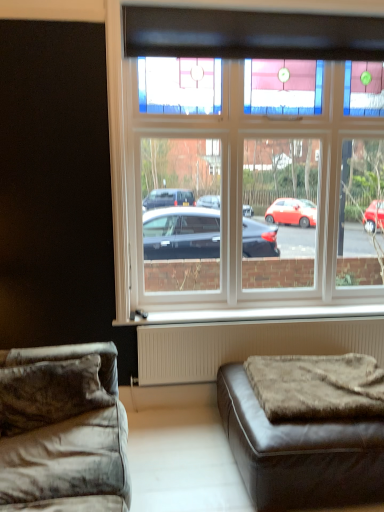
Measure the distance between point (322, 323) and camera.

Point (322, 323) and camera are 2.88 meters apart.

In order to click on clear glass window at upper center in this screenshot , I will do `click(134, 143)`.

Image resolution: width=384 pixels, height=512 pixels. Describe the element at coordinates (299, 453) in the screenshot. I see `brown leather ottoman at lower right, the second studio couch from the left` at that location.

In order to face velvet gray couch at lower left, the 2th studio couch when ordered from right to left, should I rotate leftwards or rightwards?

You should look left and rotate roughly 20.479 degrees.

What are the coordinates of `white textured radiator at lower center` in the screenshot? It's located at [x=247, y=345].

Would you say brown leather ottoman at lower right, positioned as the first studio couch in right-to-left order, is outside white textured radiator at lower center?

Indeed, brown leather ottoman at lower right, positioned as the first studio couch in right-to-left order, is completely outside white textured radiator at lower center.

Looking at this image, considering the sizes of objects brown leather ottoman at lower right, the second studio couch from the left, and white textured radiator at lower center in the image provided, who is wider, brown leather ottoman at lower right, the second studio couch from the left, or white textured radiator at lower center?

Wider between the two is brown leather ottoman at lower right, the second studio couch from the left.

Is brown leather ottoman at lower right, positioned as the first studio couch in right-to-left order, at the left side of white textured radiator at lower center?

In fact, brown leather ottoman at lower right, positioned as the first studio couch in right-to-left order, is to the right of white textured radiator at lower center.

From a real-world perspective, is brown leather ottoman at lower right, the second studio couch from the left, physically below white textured radiator at lower center?

Indeed, from a real-world perspective, brown leather ottoman at lower right, the second studio couch from the left, is positioned beneath white textured radiator at lower center.

Does clear glass window at upper center turn towards white textured radiator at lower center?

No, clear glass window at upper center does not turn towards white textured radiator at lower center.

Does clear glass window at upper center have a smaller size compared to white textured radiator at lower center?

Incorrect, clear glass window at upper center is not smaller in size than white textured radiator at lower center.

Based on the photo, which object is wider, clear glass window at upper center or white textured radiator at lower center?

white textured radiator at lower center is wider.

The image size is (384, 512). What are the coordinates of `window above the white textured radiator at lower center (from the image's perspective)` in the screenshot? It's located at (134, 143).

Considering the points (333, 350) and (357, 460), which point is behind, point (333, 350) or point (357, 460)?

Point (333, 350)

Which of these two, white textured radiator at lower center or brown leather ottoman at lower right, positioned as the first studio couch in right-to-left order, stands shorter?

brown leather ottoman at lower right, positioned as the first studio couch in right-to-left order.

Is white textured radiator at lower center positioned with its back to brown leather ottoman at lower right, positioned as the first studio couch in right-to-left order?

white textured radiator at lower center is not turned away from brown leather ottoman at lower right, positioned as the first studio couch in right-to-left order.

Is white textured radiator at lower center not close to brown leather ottoman at lower right, positioned as the first studio couch in right-to-left order?

No, white textured radiator at lower center is not far from brown leather ottoman at lower right, positioned as the first studio couch in right-to-left order.

From a real-world perspective, is white plastic window sill at lower center above or below brown leather ottoman at lower right, the second studio couch from the left?

white plastic window sill at lower center is situated higher than brown leather ottoman at lower right, the second studio couch from the left, in the real world.

In terms of size, does white plastic window sill at lower center appear bigger or smaller than brown leather ottoman at lower right, the second studio couch from the left?

In the image, white plastic window sill at lower center appears to be smaller than brown leather ottoman at lower right, the second studio couch from the left.

Measure the distance between white plastic window sill at lower center and brown leather ottoman at lower right, the second studio couch from the left.

white plastic window sill at lower center is 35.70 inches away from brown leather ottoman at lower right, the second studio couch from the left.

Is white plastic window sill at lower center positioned far away from brown leather ottoman at lower right, positioned as the first studio couch in right-to-left order?

Actually, white plastic window sill at lower center and brown leather ottoman at lower right, positioned as the first studio couch in right-to-left order, are a little close together.

From the image's perspective, is white textured radiator at lower center located above or below brown fuzzy mattress at lower right?

From the image's perspective, white textured radiator at lower center appears above brown fuzzy mattress at lower right.

Find the location of a particular element. The width and height of the screenshot is (384, 512). mattress on the right of the white textured radiator at lower center is located at coordinates (317, 387).

From the picture: Choose the correct answer: Is white textured radiator at lower center inside brown fuzzy mattress at lower right or outside it?

The correct answer is: outside.

This screenshot has width=384, height=512. Identify the location of window in front of the white textured radiator at lower center. (134, 143).

In the scene shown: In the image, is white textured radiator at lower center positioned in front of or behind clear glass window at upper center?

Clearly, white textured radiator at lower center is behind clear glass window at upper center.

From the image's perspective, is white textured radiator at lower center below clear glass window at upper center?

Yes.

Can you confirm if white textured radiator at lower center is thinner than clear glass window at upper center?

No.

Does white plastic window sill at lower center have a larger size compared to clear glass window at upper center?

Actually, white plastic window sill at lower center might be smaller than clear glass window at upper center.

Is white plastic window sill at lower center aimed at clear glass window at upper center?

No, white plastic window sill at lower center does not turn towards clear glass window at upper center.

How far apart are white plastic window sill at lower center and clear glass window at upper center?

white plastic window sill at lower center is 3.74 feet from clear glass window at upper center.

This screenshot has width=384, height=512. In order to click on studio couch that is on the right side of white textured radiator at lower center in this screenshot , I will do `click(299, 453)`.

This screenshot has height=512, width=384. What are the coordinates of `radiator behind the clear glass window at upper center` in the screenshot? It's located at (247, 345).

Based on their spatial positions, is white textured radiator at lower center or velvet gray couch at lower left, the 2th studio couch when ordered from right to left, further from brown leather ottoman at lower right, the second studio couch from the left?

Based on the image, velvet gray couch at lower left, the 2th studio couch when ordered from right to left, appears to be further to brown leather ottoman at lower right, the second studio couch from the left.

Considering their positions, is clear glass window at upper center positioned closer to brown leather ottoman at lower right, positioned as the first studio couch in right-to-left order, than velvet gray couch at lower left, which ranks as the first studio couch in left-to-right order?

Among the two, velvet gray couch at lower left, which ranks as the first studio couch in left-to-right order, is located nearer to brown leather ottoman at lower right, positioned as the first studio couch in right-to-left order.

From the image, which object appears to be farther from white plastic window sill at lower center, velvet gray couch at lower left, the 2th studio couch when ordered from right to left, or white textured radiator at lower center?

velvet gray couch at lower left, the 2th studio couch when ordered from right to left.

Looking at the image, which one is located closer to clear glass window at upper center, brown fuzzy mattress at lower right or white plastic window sill at lower center?

The object closer to clear glass window at upper center is white plastic window sill at lower center.

When comparing their distances from brown fuzzy mattress at lower right, does white plastic window sill at lower center or velvet gray couch at lower left, which ranks as the first studio couch in left-to-right order, seem further?

Based on the image, velvet gray couch at lower left, which ranks as the first studio couch in left-to-right order, appears to be further to brown fuzzy mattress at lower right.

Looking at the image, which one is located further to white textured radiator at lower center, brown fuzzy mattress at lower right or white plastic window sill at lower center?

The object further to white textured radiator at lower center is brown fuzzy mattress at lower right.

When comparing their distances from white plastic window sill at lower center, does white textured radiator at lower center or clear glass window at upper center seem closer?

The object closer to white plastic window sill at lower center is white textured radiator at lower center.

When comparing their distances from white textured radiator at lower center, does brown fuzzy mattress at lower right or velvet gray couch at lower left, the 2th studio couch when ordered from right to left, seem further?

velvet gray couch at lower left, the 2th studio couch when ordered from right to left, is positioned further to the anchor white textured radiator at lower center.

Identify the location of radiator between velvet gray couch at lower left, the 2th studio couch when ordered from right to left, and white plastic window sill at lower center in the front-back direction. Image resolution: width=384 pixels, height=512 pixels. (247, 345).

Find the location of a particular element. The width and height of the screenshot is (384, 512). radiator that lies between clear glass window at upper center and brown fuzzy mattress at lower right from top to bottom is located at coordinates click(x=247, y=345).

This screenshot has width=384, height=512. I want to click on window sill between clear glass window at upper center and white textured radiator at lower center in the up-down direction, so click(x=252, y=314).

I want to click on studio couch between clear glass window at upper center and brown leather ottoman at lower right, positioned as the first studio couch in right-to-left order, in the up-down direction, so click(x=62, y=430).